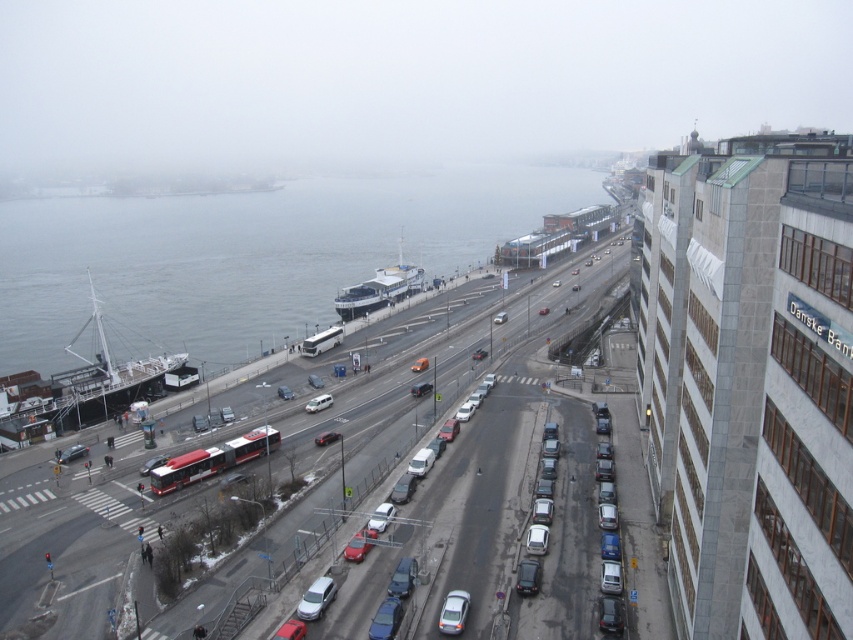
Question: Does white glossy cruise ship at center have a smaller size compared to metallic silver car at center?

Choices:
 (A) no
 (B) yes

Answer: (A)

Question: Which point is closer to the camera?

Choices:
 (A) matte red car at center
 (B) silver metallic van at center

Answer: (A)

Question: Which of these objects is positioned closest to the matte silver van at center?

Choices:
 (A) gray water at left
 (B) matte red car at center

Answer: (B)

Question: Is silver metallic van at center bigger than metallic silver sedan at center?

Choices:
 (A) no
 (B) yes

Answer: (B)

Question: Which object appears closest to the camera in this image?

Choices:
 (A) metallic silver car at center
 (B) smooth asphalt highway at center
 (C) metallic silver sedan at center

Answer: (B)

Question: Is matte black car at center above metallic silver sedan at center?

Choices:
 (A) yes
 (B) no

Answer: (B)